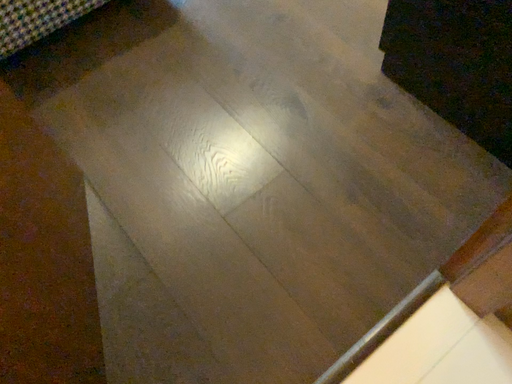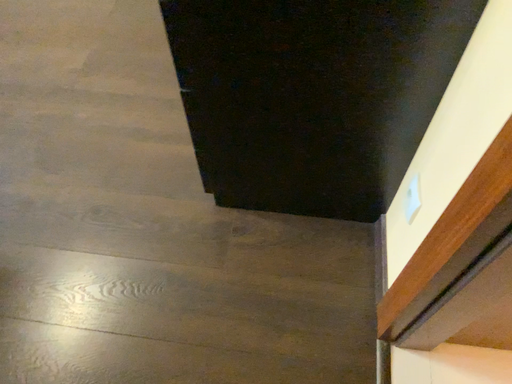
Question: Which way did the camera rotate in the video?

Choices:
 (A) rotated left
 (B) rotated right

Answer: (B)